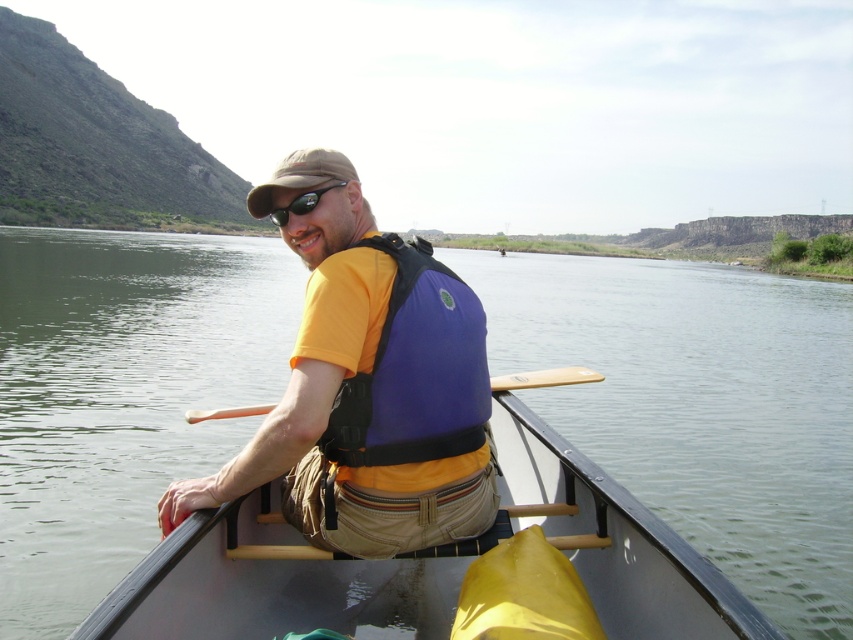
Who is higher up, yellow matte life vest at center or wooden paddle at lower center?

yellow matte life vest at center

Does yellow matte life vest at center appear on the right side of wooden paddle at lower center?

Indeed, yellow matte life vest at center is positioned on the right side of wooden paddle at lower center.

At what (x,y) coordinates should I click in order to perform the action: click on yellow matte life vest at center. Please return your answer as a coordinate pair (x, y). Looking at the image, I should click on (367, 385).

Can you confirm if smooth gray canoe at center is wider than wooden paddle at lower center?

Indeed, smooth gray canoe at center has a greater width compared to wooden paddle at lower center.

Who is higher up, smooth gray canoe at center or wooden paddle at lower center?

smooth gray canoe at center

The width and height of the screenshot is (853, 640). What are the coordinates of `smooth gray canoe at center` in the screenshot? It's located at (432, 557).

The image size is (853, 640). What are the coordinates of `smooth gray canoe at center` in the screenshot? It's located at (432, 557).

Which of these two, purple fabric life jacket at center or tan fabric baseball cap at upper center, stands shorter?

purple fabric life jacket at center is shorter.

Who is more distant from viewer, (318, 310) or (320, 156)?

The point (320, 156) is more distant.

Which is in front, point (431, 260) or point (248, 196)?

Point (431, 260)

Find the location of a particular element. purple fabric life jacket at center is located at coordinates (399, 364).